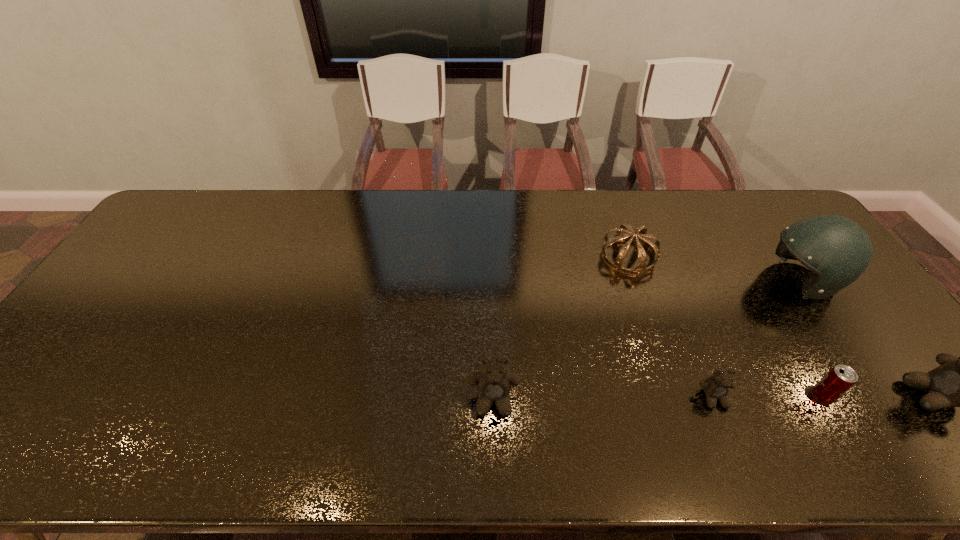
Where is `vacant space located at the face opening of the football helmet`? The height and width of the screenshot is (540, 960). vacant space located at the face opening of the football helmet is located at coordinates [x=672, y=280].

Locate an element on the screen. Image resolution: width=960 pixels, height=540 pixels. beer can at the near edge is located at coordinates (838, 380).

Identify the location of object present at the right edge. (837, 250).

The height and width of the screenshot is (540, 960). Find the location of `free space at the far edge of the desktop`. free space at the far edge of the desktop is located at coordinates (219, 227).

In the image, there is a desktop. Identify the location of vacant region at the near edge. This screenshot has height=540, width=960. (692, 411).

In the image, there is a desktop. Where is `vacant space at the left edge`? This screenshot has width=960, height=540. vacant space at the left edge is located at coordinates (96, 342).

Locate an element on the screen. The width and height of the screenshot is (960, 540). free location at the right edge is located at coordinates (802, 271).

The height and width of the screenshot is (540, 960). I want to click on free space at the far left corner, so click(x=205, y=222).

Identify the location of free space between the tallest object and the beer can. Image resolution: width=960 pixels, height=540 pixels. 811,338.

This screenshot has width=960, height=540. In order to click on empty space that is in between the beer can and the leftmost object in this screenshot , I will do `click(658, 398)`.